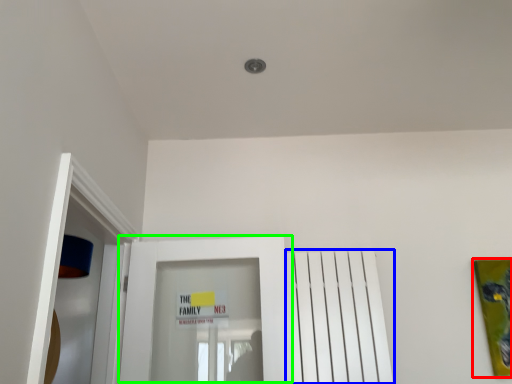
Question: Which object is the closest to the picture frame (highlighted by a red box)? Choose among these: radiator (highlighted by a blue box) or door (highlighted by a green box).

Choices:
 (A) radiator
 (B) door

Answer: (A)